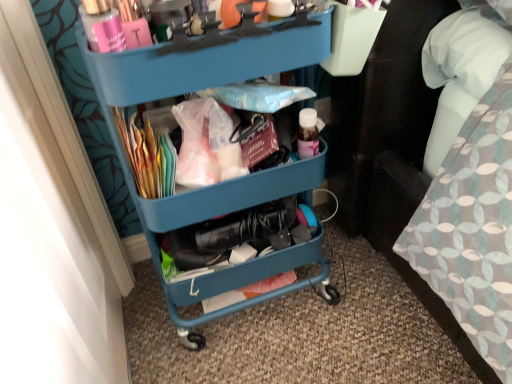
You are a GUI agent. You are given a task and a screenshot of the screen. Output one action in this format:
    pyautogui.click(x=<x>, y=<y>)
    Task: Click on the vacant area to the right of teal plastic cart at center
    Image resolution: width=512 pixels, height=384 pixels.
    Given the screenshot: What is the action you would take?
    pyautogui.click(x=366, y=296)